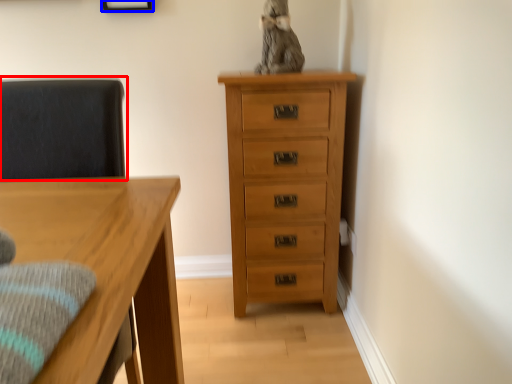
Question: Which object is closer to the camera taking this photo, swivel chair (highlighted by a red box) or picture frame (highlighted by a blue box)?

Choices:
 (A) swivel chair
 (B) picture frame

Answer: (A)